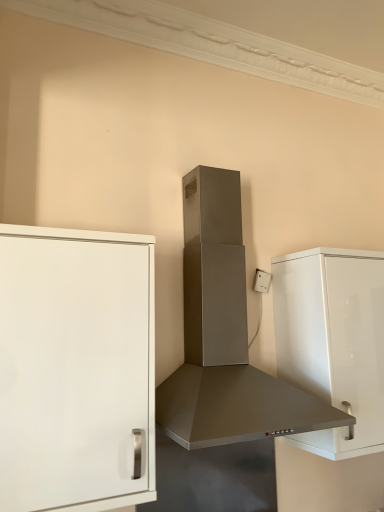
Question: Is white plastic electric outlet at upper right to the left or to the right of white glossy cabinet at right, the second cabinetry in the left-to-right sequence, in the image?

Choices:
 (A) right
 (B) left

Answer: (B)

Question: Considering the positions of point (261, 279) and point (377, 295), is point (261, 279) closer or farther from the camera than point (377, 295)?

Choices:
 (A) closer
 (B) farther

Answer: (B)

Question: Based on their relative distances, which object is farther from the white matte cabinet at left, which is the 1th cabinetry from left to right?

Choices:
 (A) white plastic electric outlet at upper right
 (B) satin silver range hood at center
 (C) white glossy cabinet at right, which ranks as the 1th cabinetry in back-to-front order

Answer: (A)

Question: Estimate the real-world distances between objects in this image. Which object is closer to the white glossy cabinet at right, which ranks as the 1th cabinetry in back-to-front order?

Choices:
 (A) white plastic electric outlet at upper right
 (B) satin silver range hood at center
 (C) white matte cabinet at left, marked as the 1th cabinetry in a front-to-back arrangement

Answer: (B)